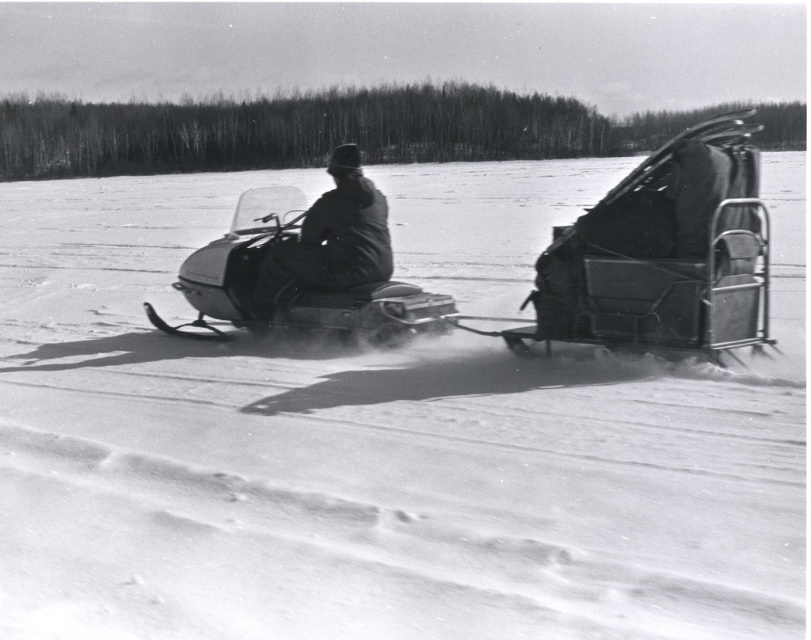
Can you confirm if metallic silver snowmobile at center-left is positioned to the right of dark fabric jacket at center?

Incorrect, metallic silver snowmobile at center-left is not on the right side of dark fabric jacket at center.

Between metallic silver snowmobile at center-left and dark fabric jacket at center, which one appears on the right side from the viewer's perspective?

From the viewer's perspective, dark fabric jacket at center appears more on the right side.

Image resolution: width=811 pixels, height=640 pixels. What do you see at coordinates (292, 284) in the screenshot?
I see `metallic silver snowmobile at center-left` at bounding box center [292, 284].

Locate an element on the screen. metallic silver snowmobile at center-left is located at coordinates (292, 284).